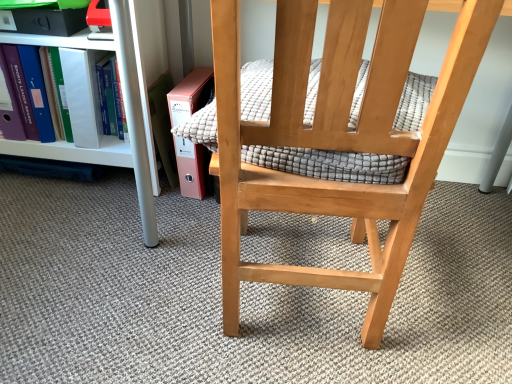
What is the approximate height of matte white folder at left?

The height of matte white folder at left is 12.54 inches.

Find the location of `textured gray quilt at center`. textured gray quilt at center is located at coordinates (329, 164).

This screenshot has width=512, height=384. Describe the element at coordinates (329, 164) in the screenshot. I see `textured gray quilt at center` at that location.

Identify the location of white plastic shelf at left. (124, 104).

I want to click on matte white folder at left, so click(x=82, y=95).

In the image, there is a pink cardboard book at lower left. At what (x,y) coordinates should I click in order to perform the action: click on book above it (from the image's perspective). Please return your answer as a coordinate pair (x, y). The image size is (512, 384). Looking at the image, I should click on (82, 95).

Measure the distance from matte white folder at left to pink cardboard book at lower left.

A distance of 8.48 inches exists between matte white folder at left and pink cardboard book at lower left.

Can you confirm if matte white folder at left is shorter than pink cardboard book at lower left?

Yes, matte white folder at left is shorter than pink cardboard book at lower left.

From a real-world perspective, is matte white folder at left under pink cardboard book at lower left?

No, from a real-world perspective, matte white folder at left is not beneath pink cardboard book at lower left.

From a real-world perspective, is pink cardboard book at lower left positioned above or below textured gray quilt at center?

pink cardboard book at lower left is situated lower than textured gray quilt at center in the real world.

Locate an element on the screen. The image size is (512, 384). quilt on the right of pink cardboard book at lower left is located at coordinates (329, 164).

Can you confirm if pink cardboard book at lower left is smaller than textured gray quilt at center?

Correct, pink cardboard book at lower left occupies less space than textured gray quilt at center.

In terms of width, does pink cardboard book at lower left look wider or thinner when compared to textured gray quilt at center?

pink cardboard book at lower left is thinner than textured gray quilt at center.

How different are the orientations of natural wood chair at center and textured gray quilt at center in degrees?

natural wood chair at center and textured gray quilt at center are facing 4.78 degrees away from each other.

Who is smaller, natural wood chair at center or textured gray quilt at center?

textured gray quilt at center.

Which is behind, point (232, 61) or point (412, 120)?

The point (412, 120) is farther.

Could you tell me if natural wood chair at center is facing textured gray quilt at center?

Yes, natural wood chair at center faces towards textured gray quilt at center.

Is the depth of natural wood chair at center less than that of pink cardboard book at lower left?

Yes, natural wood chair at center is closer to the viewer.

Is natural wood chair at center positioned far away from pink cardboard book at lower left?

natural wood chair at center is actually quite close to pink cardboard book at lower left.

Between natural wood chair at center and pink cardboard book at lower left, which one has smaller size?

pink cardboard book at lower left is smaller.

From the picture: Which is correct: natural wood chair at center is inside pink cardboard book at lower left, or outside of it?

natural wood chair at center is outside pink cardboard book at lower left.

Is matte white folder at left thinner than natural wood chair at center?

Indeed, matte white folder at left has a lesser width compared to natural wood chair at center.

Between point (89, 57) and point (317, 86), which one is positioned in front?

The point (317, 86) is in front.

Is matte white folder at left facing towards natural wood chair at center?

No, matte white folder at left does not turn towards natural wood chair at center.

Between point (68, 41) and point (153, 89), which one is positioned behind?

Point (153, 89)

Where is `shelf above the pink cardboard book at lower left (from the image's perspective)`? shelf above the pink cardboard book at lower left (from the image's perspective) is located at coordinates (124, 104).

Is white plastic shelf at left shorter than pink cardboard book at lower left?

No.

Is white plastic shelf at left facing away from pink cardboard book at lower left?

That's not correct — white plastic shelf at left is not looking away from pink cardboard book at lower left.

Is textured gray quilt at center positioned with its back to white plastic shelf at left?

That's not correct — textured gray quilt at center is not looking away from white plastic shelf at left.

Can you confirm if textured gray quilt at center is smaller than white plastic shelf at left?

Correct, textured gray quilt at center occupies less space than white plastic shelf at left.

From the image's perspective, between textured gray quilt at center and white plastic shelf at left, which one is located above?

white plastic shelf at left is shown above in the image.

Is point (437, 77) positioned after point (123, 82)?

Yes, it is.

The width and height of the screenshot is (512, 384). I want to click on book that appears above the pink cardboard book at lower left (from a real-world perspective), so click(x=82, y=95).

Where is `paperback book that is behind the textured gray quilt at center`? paperback book that is behind the textured gray quilt at center is located at coordinates (163, 126).

When comparing their distances from natural wood chair at center, does textured gray quilt at center or pink cardboard book at lower left seem further?

Based on the image, pink cardboard book at lower left appears to be further to natural wood chair at center.

Looking at the image, which one is located further to pink cardboard book at lower left, white plastic shelf at left or natural wood chair at center?

natural wood chair at center is further to pink cardboard book at lower left.

Which object lies nearer to the anchor point textured gray quilt at center, white plastic shelf at left or matte white folder at left?

white plastic shelf at left is positioned closer to the anchor textured gray quilt at center.

From the image, which object appears to be nearer to textured gray quilt at center, matte white folder at left or pink cardboard book at lower left?

Based on the image, pink cardboard book at lower left appears to be nearer to textured gray quilt at center.

Estimate the real-world distances between objects in this image. Which object is closer to natural wood chair at center, white plastic shelf at left or textured gray quilt at center?

textured gray quilt at center.

Considering their positions, is natural wood chair at center positioned further to matte white folder at left than white plastic shelf at left?

The object further to matte white folder at left is natural wood chair at center.

Based on the photo, looking at the image, which one is located closer to matte white folder at left, natural wood chair at center or pink cardboard book at lower left?

pink cardboard book at lower left is closer to matte white folder at left.

From the image, which object appears to be nearer to textured gray quilt at center, natural wood chair at center or matte white folder at left?

Based on the image, natural wood chair at center appears to be nearer to textured gray quilt at center.

Image resolution: width=512 pixels, height=384 pixels. In order to click on shelf situated between matte white folder at left and textured gray quilt at center from left to right in this screenshot , I will do `click(124, 104)`.

Find the location of a particular element. chair situated between white plastic shelf at left and textured gray quilt at center from left to right is located at coordinates (335, 134).

At what (x,y) coordinates should I click in order to perform the action: click on book positioned between natural wood chair at center and pink cardboard book at lower left from near to far. Please return your answer as a coordinate pair (x, y). Looking at the image, I should click on (82, 95).

You are a GUI agent. You are given a task and a screenshot of the screen. Output one action in this format:
    pyautogui.click(x=<x>, y=<y>)
    Task: Click on the paperback book situated between white plastic shelf at left and textured gray quilt at center from left to right
    The height and width of the screenshot is (384, 512).
    Given the screenshot: What is the action you would take?
    pyautogui.click(x=163, y=126)